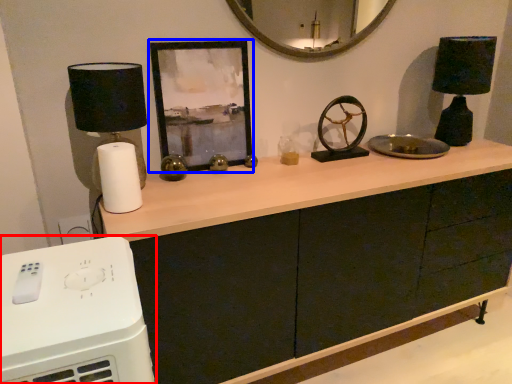
Question: Which point is further to the camera, home appliance (highlighted by a red box) or picture frame (highlighted by a blue box)?

Choices:
 (A) home appliance
 (B) picture frame

Answer: (B)